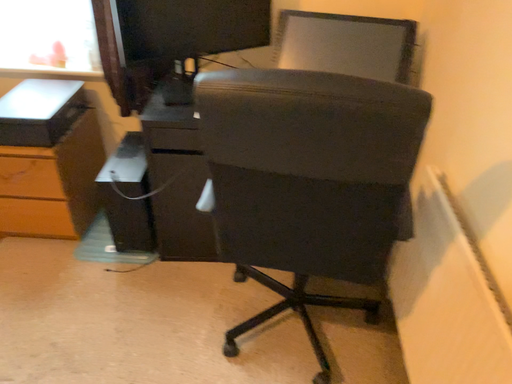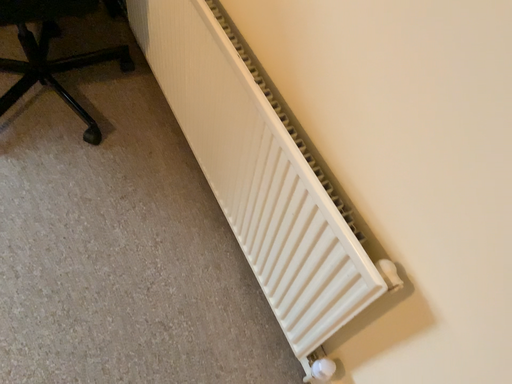
Question: How did the camera likely rotate when shooting the video?

Choices:
 (A) rotated downward
 (B) rotated upward

Answer: (A)